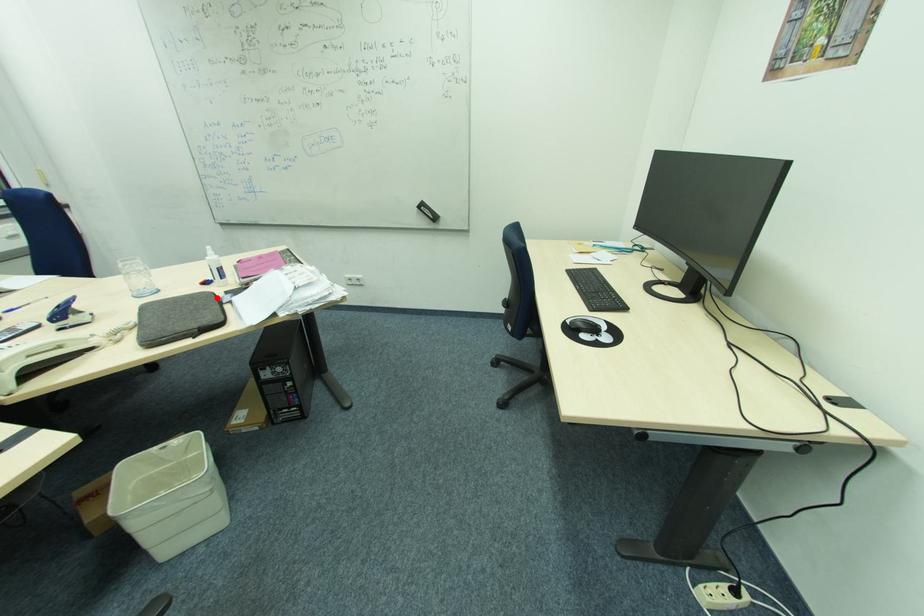
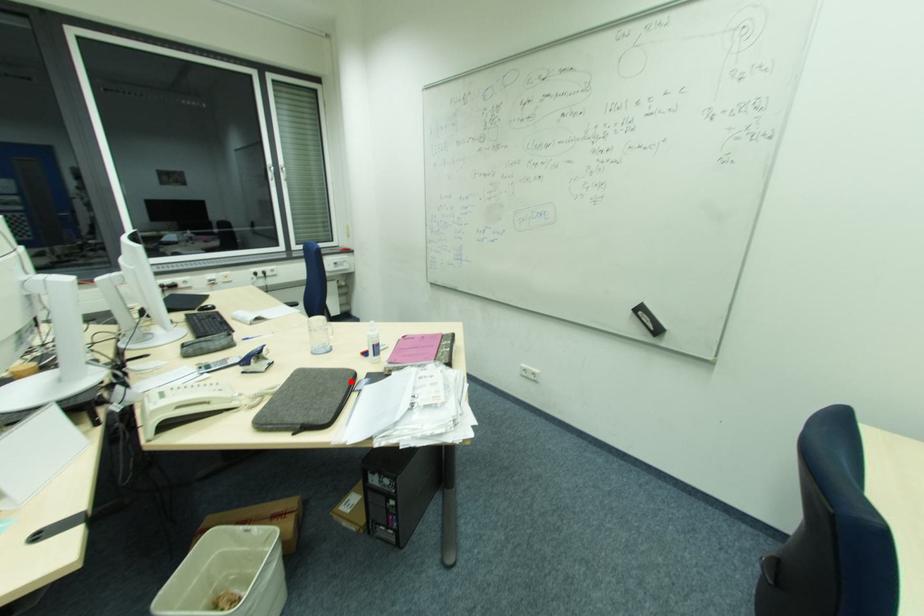
I am providing you with two images of the same scene from different viewpoints. A red point is marked on the first image and another point is marked on the second image. Do the highlighted points in image1 and image2 indicate the same real-world spot?

Yes